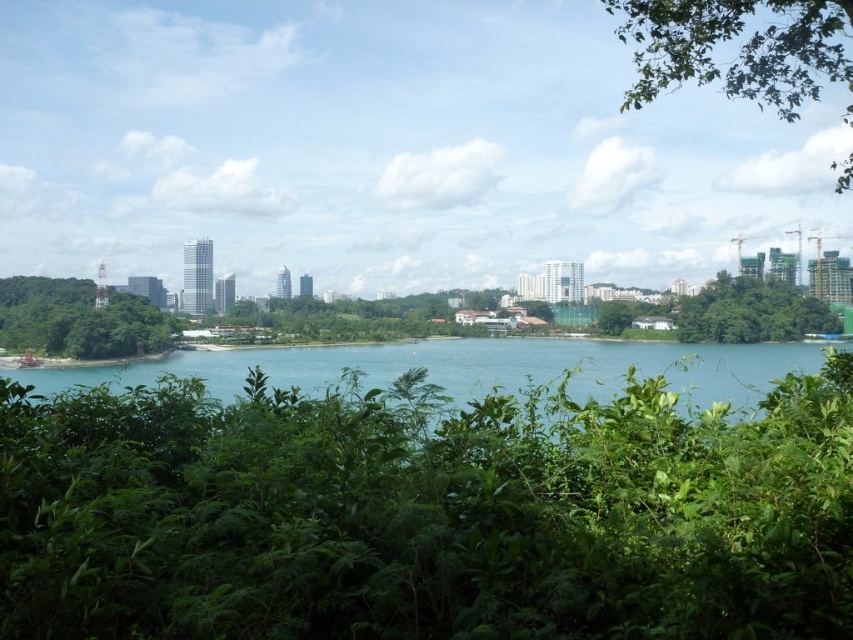
Question: Where is blue water at center located in relation to green leafy tree at left in the image?

Choices:
 (A) below
 (B) above

Answer: (A)

Question: Can you confirm if green leafy vegetation at center is wider than blue water at center?

Choices:
 (A) yes
 (B) no

Answer: (B)

Question: Which is nearer to the green leafy tree at right?

Choices:
 (A) green leafy tree at left
 (B) blue water at center
 (C) green leafy vegetation at center

Answer: (B)

Question: Which point is closer to the camera taking this photo?

Choices:
 (A) (126, 490)
 (B) (819, 40)
 (C) (33, 326)
 (D) (706, 308)

Answer: (A)

Question: Which point is farther to the camera?

Choices:
 (A) (601, 636)
 (B) (698, 301)
 (C) (381, 358)

Answer: (B)

Question: Is the position of green leafy tree at upper right less distant than that of green leafy tree at right?

Choices:
 (A) yes
 (B) no

Answer: (A)